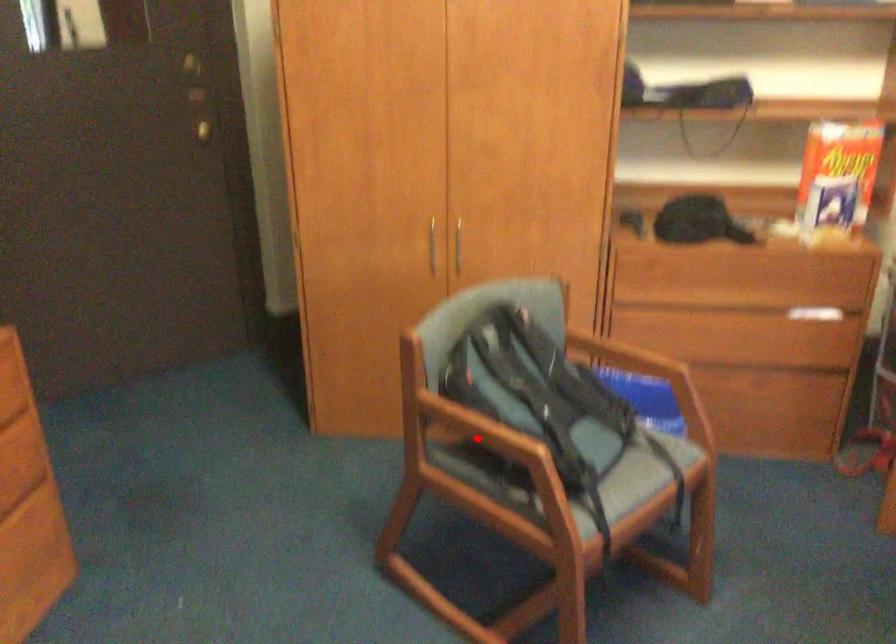
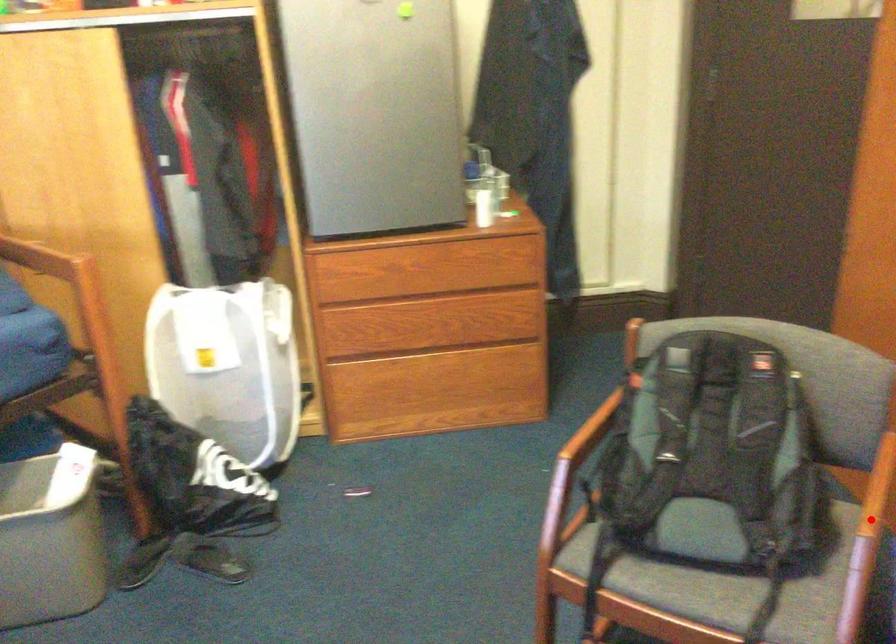
Based on the photo, I am providing you with two images of the same scene from different viewpoints. A red point is marked on the first image and another point is marked on the second image. Are the points marked in image1 and image2 representing the same 3D position?

No